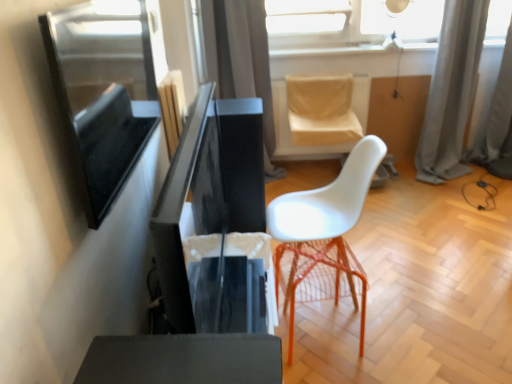
Question: Considering the positions of point (70, 24) and point (308, 117), is point (70, 24) closer or farther from the camera than point (308, 117)?

Choices:
 (A) closer
 (B) farther

Answer: (A)

Question: From a real-world perspective, is matte black screen at left positioned above or below beige fabric swivel chair at upper center?

Choices:
 (A) above
 (B) below

Answer: (A)

Question: Estimate the real-world distances between objects in this image. Which object is farther from the white plastic chair at center?

Choices:
 (A) glossy black computer desk at center
 (B) beige fabric swivel chair at upper center
 (C) gray fabric curtain at upper right, acting as the 3th curtain starting from the left
 (D) transparent glass lampshade at upper center
 (E) matte black screen at left

Answer: (C)

Question: Which is farther from the gray fabric curtain at upper right, which is the 1th curtain from right to left?

Choices:
 (A) beige fabric swivel chair at upper center
 (B) matte black screen at left
 (C) glossy black computer desk at center
 (D) gray fabric curtain at upper right, which is the 2th curtain in right-to-left order
 (E) transparent glass lampshade at upper center

Answer: (B)